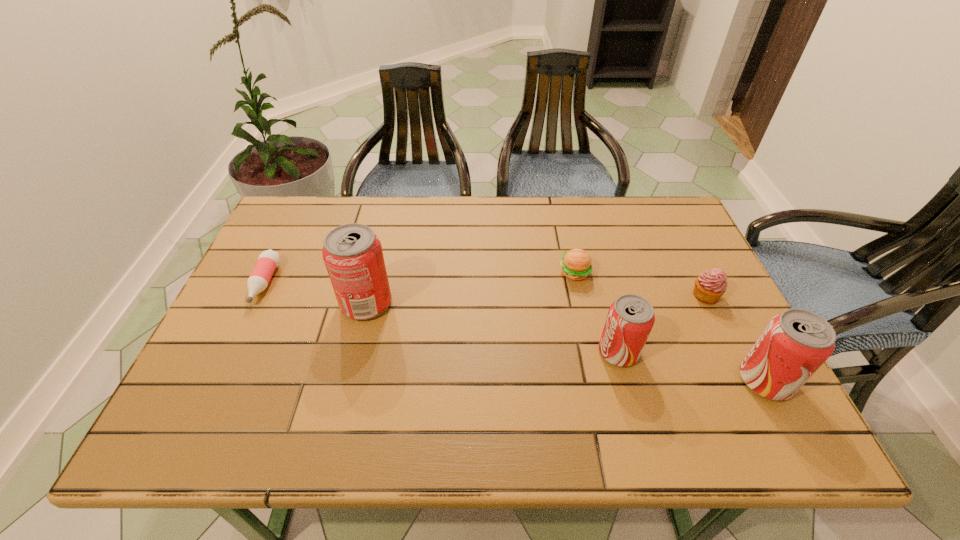
Find the location of a particular element. This screenshot has width=960, height=540. vacant space that is in between the shortest object and the second shortest soda can is located at coordinates (515, 332).

Where is `free point between the third shortest object and the shortest object`? Image resolution: width=960 pixels, height=540 pixels. free point between the third shortest object and the shortest object is located at coordinates (485, 289).

Where is `blank region between the shortest object and the fifth tallest object`? The image size is (960, 540). blank region between the shortest object and the fifth tallest object is located at coordinates (420, 278).

Identify the location of unoccupied area between the leftmost soda can and the cupcake. This screenshot has width=960, height=540. (536, 299).

Locate an element on the screen. The height and width of the screenshot is (540, 960). vacant area that lies between the second shortest object and the bottle is located at coordinates (420, 278).

This screenshot has width=960, height=540. Find the location of `unoccupied area between the second shortest object and the fourth shortest object`. unoccupied area between the second shortest object and the fourth shortest object is located at coordinates pyautogui.click(x=596, y=312).

Where is `empty location between the fourth tallest object and the hamburger`? This screenshot has height=540, width=960. empty location between the fourth tallest object and the hamburger is located at coordinates (640, 284).

Identify which object is the second closest to the cupcake. Please provide its 2D coordinates. Your answer should be formatted as a tuple, i.e. [(x, y)], where the tuple contains the x and y coordinates of a point satisfying the conditions above.

[(630, 319)]

Identify which object is the second closest to the fifth object from right to left. Please provide its 2D coordinates. Your answer should be formatted as a tuple, i.e. [(x, y)], where the tuple contains the x and y coordinates of a point satisfying the conditions above.

[(576, 264)]

Find the location of a particular element. The width and height of the screenshot is (960, 540). the closest soda can to the shortest soda can is located at coordinates (795, 343).